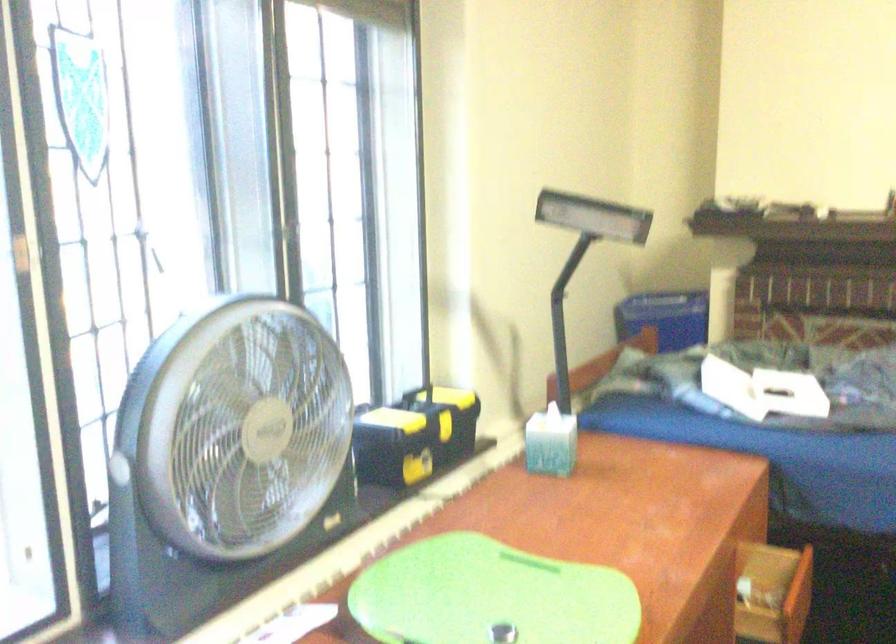
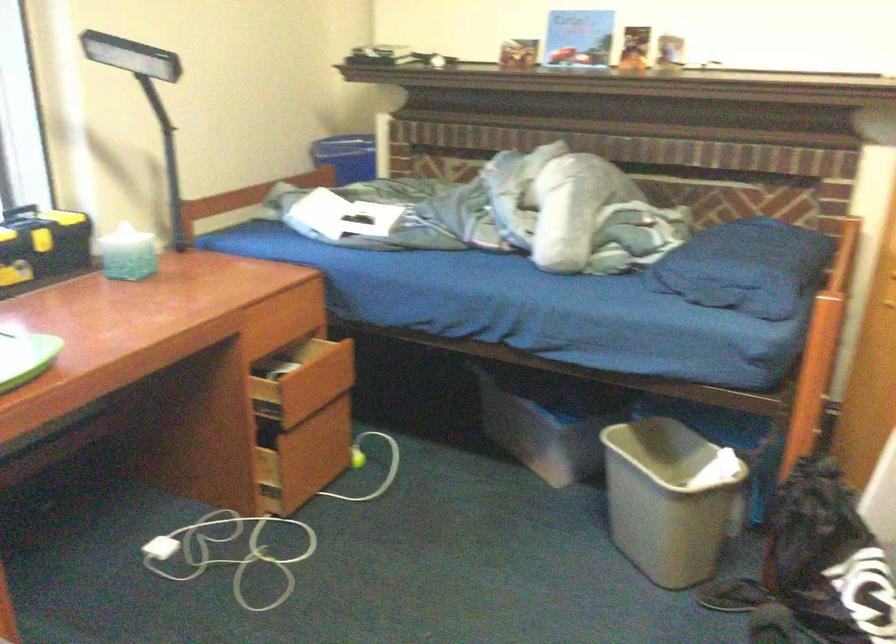
The images are taken continuously from a first-person perspective. In which direction are you moving?

The cameraman moved toward right, backward.